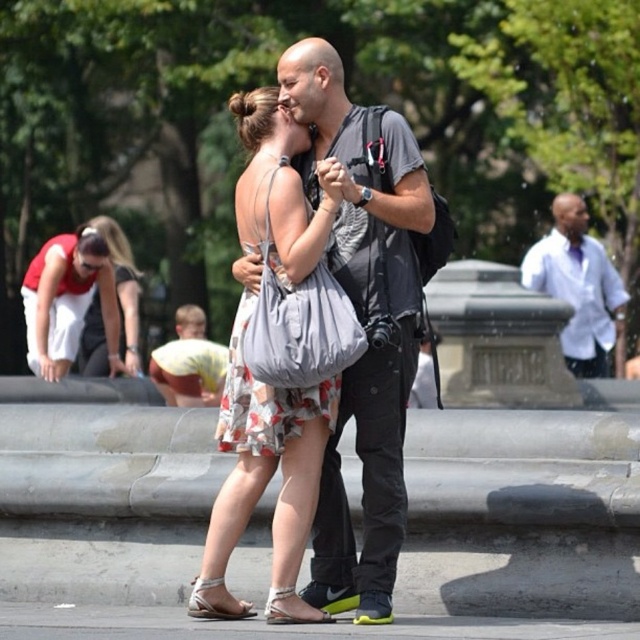
Question: Which point appears closest to the camera in this image?

Choices:
 (A) pos(234,618)
 (B) pos(104,230)

Answer: (A)

Question: Does matte gray shirt at center have a lesser width compared to white leather sandal at lower center?

Choices:
 (A) no
 (B) yes

Answer: (A)

Question: Which point is farther to the camera?

Choices:
 (A) (90, 316)
 (B) (280, 598)

Answer: (A)

Question: Is white cotton shirt at right below white leather sandal at lower center?

Choices:
 (A) yes
 (B) no

Answer: (B)

Question: Which of the following is the farthest from the observer?

Choices:
 (A) (342, 586)
 (B) (248, 616)

Answer: (B)

Question: Does matte gray shirt at center appear under white cotton shirt at right?

Choices:
 (A) yes
 (B) no

Answer: (B)